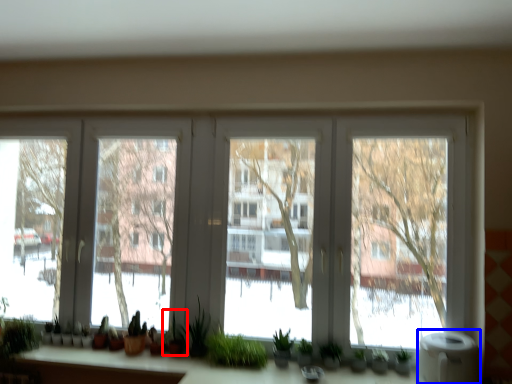
Question: Which object is closer to the camera taking this photo, plant (highlighted by a red box) or water heater (highlighted by a blue box)?

Choices:
 (A) plant
 (B) water heater

Answer: (B)